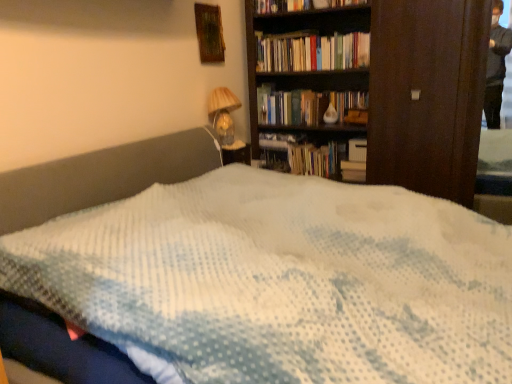
This screenshot has height=384, width=512. What do you see at coordinates (223, 113) in the screenshot?
I see `matte glass table lamp at upper center` at bounding box center [223, 113].

Measure the distance between point [354,152] and camera.

The depth of point [354,152] is 2.92 meters.

This screenshot has height=384, width=512. Find the location of `matte glass table lamp at upper center`. matte glass table lamp at upper center is located at coordinates (223, 113).

From the image's perspective, which one is positioned lower, hardcover books at upper center or wooden frame at upper center?

hardcover books at upper center, from the image's perspective.

Which object is thinner, hardcover books at upper center or wooden frame at upper center?

With smaller width is wooden frame at upper center.

Which of these two, hardcover books at upper center or wooden frame at upper center, is bigger?

hardcover books at upper center is bigger.

Which is behind, wooden frame at upper center or matte glass table lamp at upper center?

matte glass table lamp at upper center is further from the camera.

Is wooden frame at upper center shorter than matte glass table lamp at upper center?

Yes.

Considering the sizes of objects wooden frame at upper center and matte glass table lamp at upper center in the image provided, who is wider, wooden frame at upper center or matte glass table lamp at upper center?

matte glass table lamp at upper center is wider.

Can you see wooden frame at upper center touching matte glass table lamp at upper center?

No.

Which of these two, matte glass table lamp at upper center or wooden frame at upper center, is smaller?

With smaller size is wooden frame at upper center.

In the image, is matte glass table lamp at upper center on the left side or the right side of wooden frame at upper center?

In the image, matte glass table lamp at upper center appears on the right side of wooden frame at upper center.

Does matte glass table lamp at upper center have a greater width compared to wooden frame at upper center?

Correct, the width of matte glass table lamp at upper center exceeds that of wooden frame at upper center.

What's the angular difference between matte glass table lamp at upper center and wooden frame at upper center's facing directions?

0.122 degrees separate the facing orientations of matte glass table lamp at upper center and wooden frame at upper center.

Does hardcover books at upper center lie in front of white matte paperback book at center-right?

Yes, it is.

Does point (341, 57) lie behind point (349, 144)?

No, (341, 57) is in front of (349, 144).

Image resolution: width=512 pixels, height=384 pixels. What are the coordinates of `paperback book behind the hardcover books at upper center` in the screenshot? It's located at (357, 150).

Considering the relative positions of hardcover books at upper center and white matte paperback book at center-right in the image provided, is hardcover books at upper center to the left of white matte paperback book at center-right from the viewer's perspective?

Yes, hardcover books at upper center is to the left of white matte paperback book at center-right.

Is hardcover books at upper center looking in the opposite direction of matte glass table lamp at upper center?

No.

Can you confirm if hardcover books at upper center is positioned to the right of matte glass table lamp at upper center?

Yes, hardcover books at upper center is to the right of matte glass table lamp at upper center.

Is point (358, 39) behind point (219, 105)?

Yes, it is.

Are white matte paperback book at center-right and hardcover books at upper center located far from each other?

No, white matte paperback book at center-right is not far away from hardcover books at upper center.

Between white matte paperback book at center-right and hardcover books at upper center, which one is positioned behind?

white matte paperback book at center-right is behind.

In the image, is white matte paperback book at center-right on the left side or the right side of hardcover books at upper center?

Based on their positions, white matte paperback book at center-right is located to the right of hardcover books at upper center.

Does white matte paperback book at center-right turn towards hardcover books at upper center?

No, white matte paperback book at center-right is not facing towards hardcover books at upper center.

Between matte glass table lamp at upper center and white matte paperback book at center-right, which one has larger width?

Wider between the two is matte glass table lamp at upper center.

Consider the image. Which object is more forward, matte glass table lamp at upper center or white matte paperback book at center-right?

Positioned in front is matte glass table lamp at upper center.

From the image's perspective, is matte glass table lamp at upper center positioned above or below white matte paperback book at center-right?

From the image's perspective, matte glass table lamp at upper center appears above white matte paperback book at center-right.

In the image, there is a wooden frame at upper center. At what (x,y) coordinates should I click in order to perform the action: click on book below it (from a real-world perspective). Please return your answer as a coordinate pair (x, y). The height and width of the screenshot is (384, 512). Looking at the image, I should click on (313, 52).

Locate an element on the screen. Image resolution: width=512 pixels, height=384 pixels. table lamp lying behind the wooden frame at upper center is located at coordinates (223, 113).

From the image, which object appears to be nearer to white matte paperback book at center-right, hardcover books at upper center or matte glass table lamp at upper center?

hardcover books at upper center is positioned closer to the anchor white matte paperback book at center-right.

From the image, which object appears to be farther from hardcover books at upper center, white matte paperback book at center-right or matte glass table lamp at upper center?

white matte paperback book at center-right is further to hardcover books at upper center.

Considering their positions, is white matte paperback book at center-right positioned closer to matte glass table lamp at upper center than wooden frame at upper center?

wooden frame at upper center.

Which object lies further to the anchor point wooden frame at upper center, hardcover books at upper center or matte glass table lamp at upper center?

hardcover books at upper center is positioned further to the anchor wooden frame at upper center.

Looking at the image, which one is located further to wooden frame at upper center, matte glass table lamp at upper center or white matte paperback book at center-right?

white matte paperback book at center-right lies further to wooden frame at upper center than the other object.

Estimate the real-world distances between objects in this image. Which object is further from hardcover books at upper center, matte glass table lamp at upper center or white matte paperback book at center-right?

white matte paperback book at center-right is further to hardcover books at upper center.

Looking at the image, which one is located further to wooden frame at upper center, matte glass table lamp at upper center or hardcover books at upper center?

hardcover books at upper center lies further to wooden frame at upper center than the other object.

When comparing their distances from matte glass table lamp at upper center, does white matte paperback book at center-right or hardcover books at upper center seem further?

Among the two, white matte paperback book at center-right is located further to matte glass table lamp at upper center.

Find the location of a particular element. book situated between wooden frame at upper center and white matte paperback book at center-right from left to right is located at coordinates (313, 52).

Locate an element on the screen. The width and height of the screenshot is (512, 384). book between matte glass table lamp at upper center and white matte paperback book at center-right from left to right is located at coordinates (313, 52).

Locate an element on the screen. table lamp between wooden frame at upper center and hardcover books at upper center in the horizontal direction is located at coordinates (223, 113).

Locate an element on the screen. This screenshot has height=384, width=512. table lamp located between wooden frame at upper center and white matte paperback book at center-right in the left-right direction is located at coordinates (223, 113).